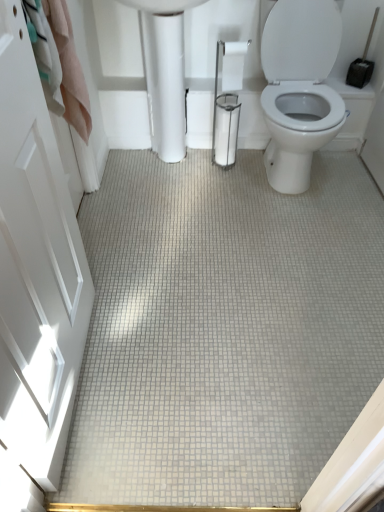
Question: Is white glossy toilet paper at center bigger or smaller than white glossy porcelain at center?

Choices:
 (A) small
 (B) big

Answer: (A)

Question: Is white glossy toilet paper at center spatially inside white glossy porcelain at center, or outside of it?

Choices:
 (A) outside
 (B) inside

Answer: (B)

Question: Which is nearer to the white glossy porcelain at center?

Choices:
 (A) white glossy door at left
 (B) white glossy toilet paper at center

Answer: (B)

Question: Estimate the real-world distances between objects in this image. Which object is closer to the white glossy porcelain at center?

Choices:
 (A) white glossy door at left
 (B) white glossy toilet paper at center

Answer: (B)